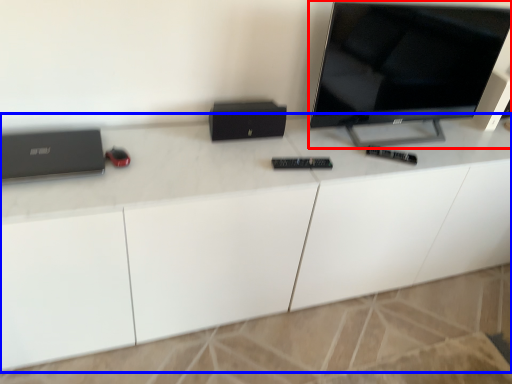
Question: Among these objects, which one is nearest to the camera, television (highlighted by a red box) or desk (highlighted by a blue box)?

Choices:
 (A) television
 (B) desk

Answer: (B)